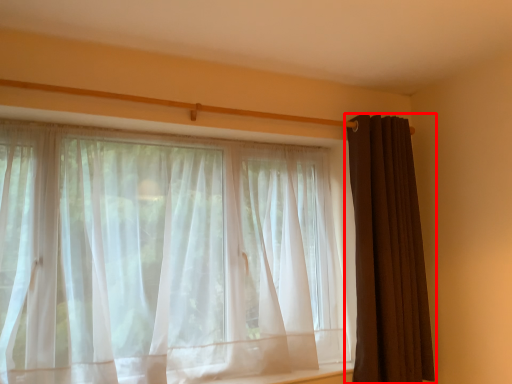
Question: Observing the image, what is the correct spatial positioning of curtain (annotated by the red box) in reference to curtain?

Choices:
 (A) left
 (B) right

Answer: (B)